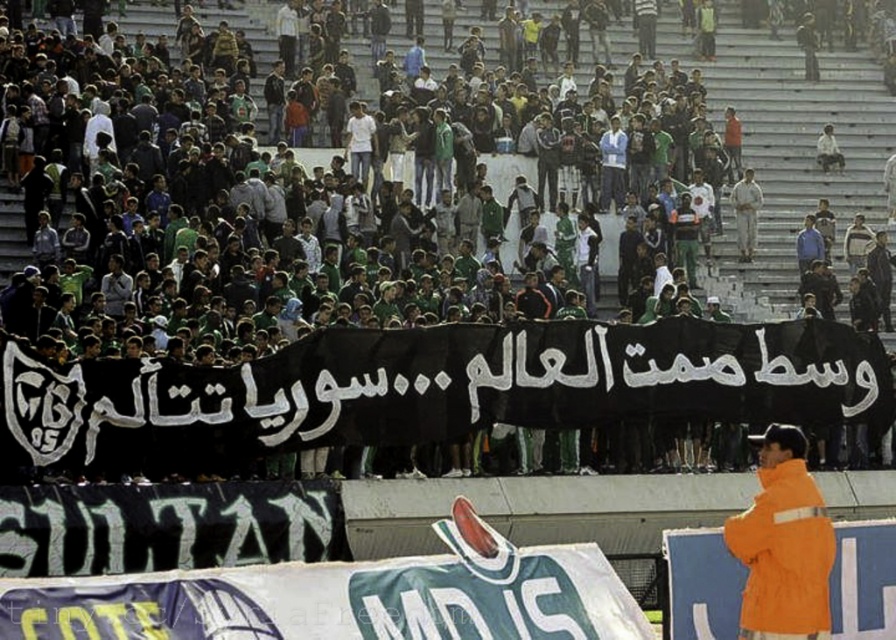
Question: Which of the following is the farthest from the observer?

Choices:
 (A) orange matte jacket at lower right
 (B) black fabric banner at center

Answer: (B)

Question: Which of the following is the closest to the observer?

Choices:
 (A) (762, 552)
 (B) (718, 408)

Answer: (A)

Question: Which point appears closest to the camera in this image?

Choices:
 (A) pos(729,134)
 (B) pos(751,552)

Answer: (B)

Question: Does black fabric banner at center have a larger size compared to orange matte jacket at lower right?

Choices:
 (A) yes
 (B) no

Answer: (A)

Question: Is black fabric banner at center below orange matte jacket at lower right?

Choices:
 (A) yes
 (B) no

Answer: (B)

Question: Can you confirm if black fabric banner at center is bigger than orange matte jacket at lower right?

Choices:
 (A) yes
 (B) no

Answer: (A)